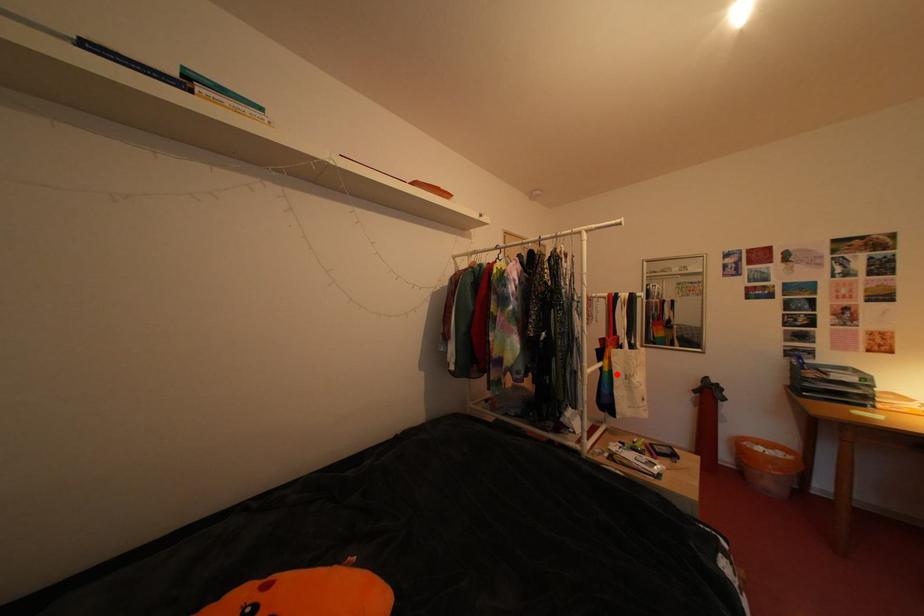
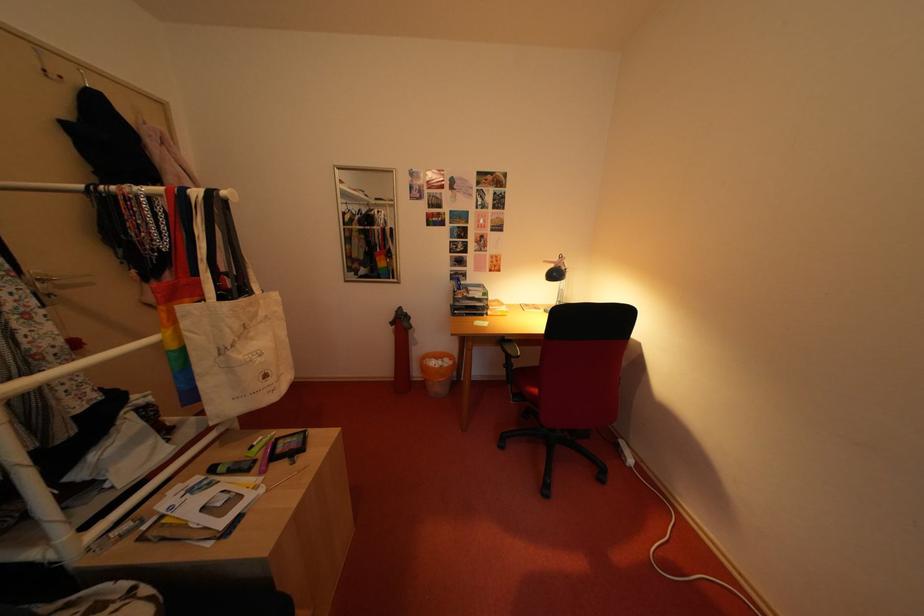
Where in the second image is the point corresponding to the highlighted location from the first image?

(184, 352)